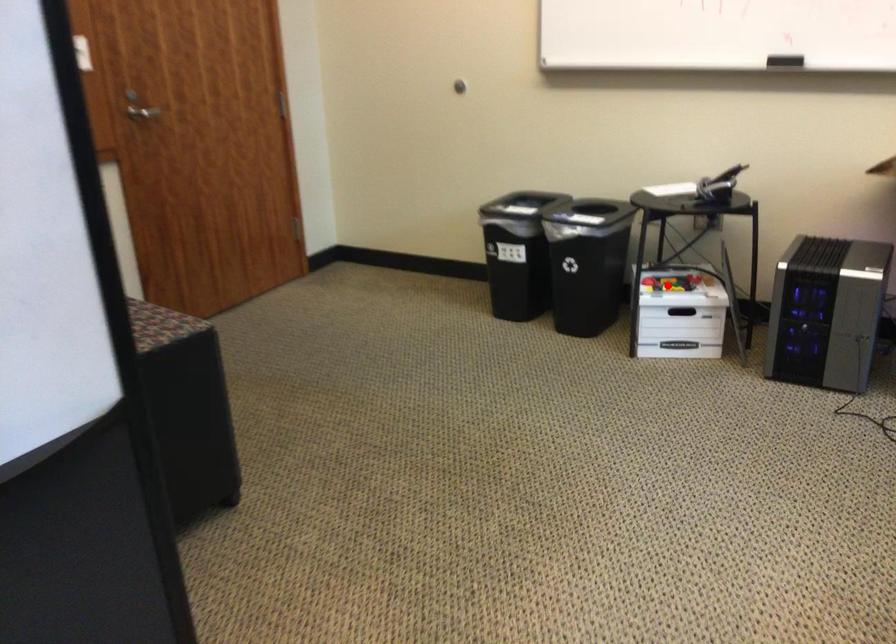
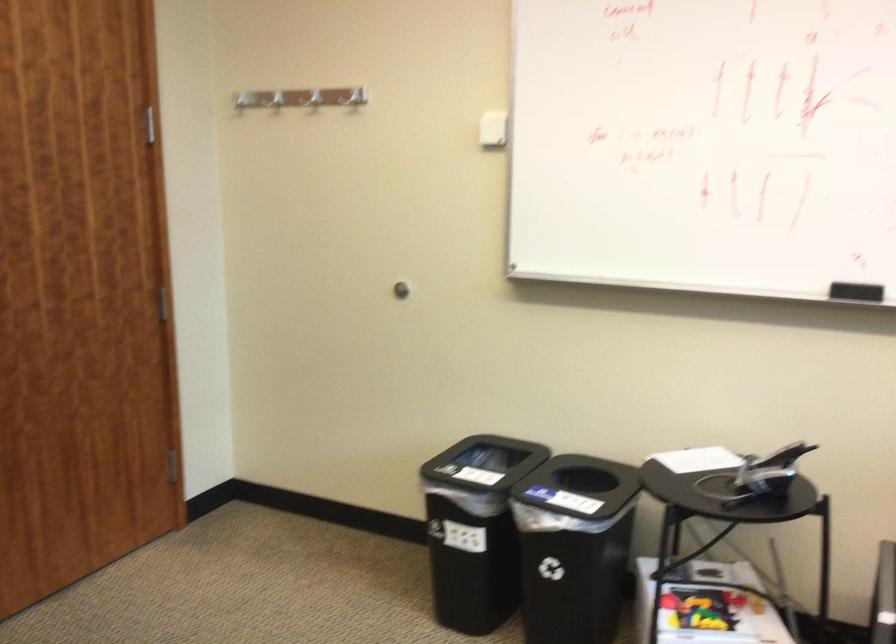
Question: I am providing you with two images of the same scene from different viewpoints. A red point is shown in image1. For the corresponding object point in image2, is it positioned nearer or farther from the camera?

Choices:
 (A) Nearer
 (B) Farther

Answer: (A)